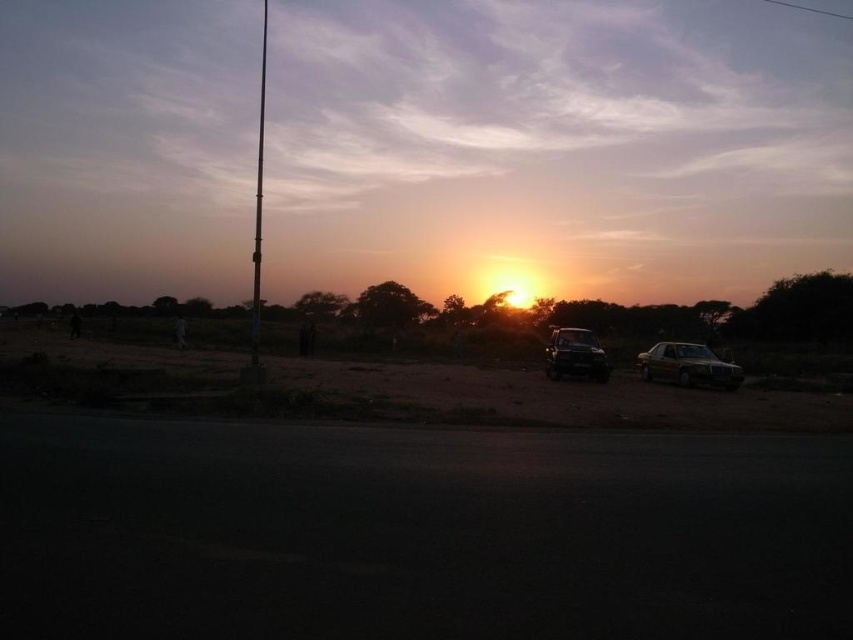
Can you confirm if brown sandy dirt field at center is bigger than metallic gold sedan at right?

Correct, brown sandy dirt field at center is larger in size than metallic gold sedan at right.

Does brown sandy dirt field at center have a smaller size compared to metallic gold sedan at right?

Incorrect, brown sandy dirt field at center is not smaller in size than metallic gold sedan at right.

This screenshot has height=640, width=853. Find the location of `brown sandy dirt field at center`. brown sandy dirt field at center is located at coordinates pos(383,388).

Does metallic gold sedan at right appear over metallic pole at left?

No.

Who is positioned more to the left, metallic gold sedan at right or metallic pole at left?

metallic pole at left

In order to click on metallic gold sedan at right in this screenshot , I will do `click(688, 365)`.

Locate an element on the screen. metallic gold sedan at right is located at coordinates (688, 365).

How much distance is there between metallic gold sedan at right and shiny metallic car at center?

A distance of 3.35 meters exists between metallic gold sedan at right and shiny metallic car at center.

Can you confirm if metallic gold sedan at right is taller than shiny metallic car at center?

No.

You are a GUI agent. You are given a task and a screenshot of the screen. Output one action in this format:
    pyautogui.click(x=<x>, y=<y>)
    Task: Click on the metallic gold sedan at right
    
    Given the screenshot: What is the action you would take?
    pyautogui.click(x=688, y=365)